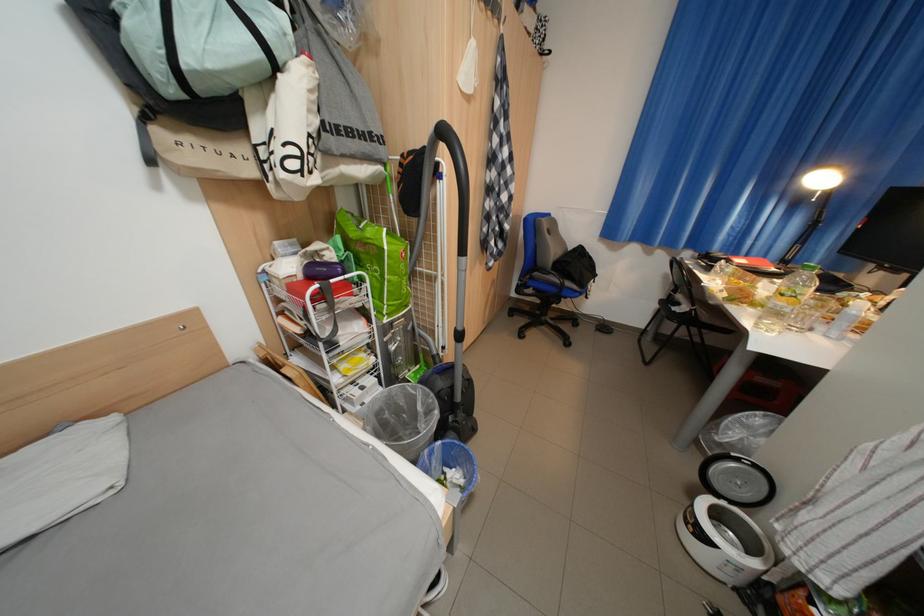
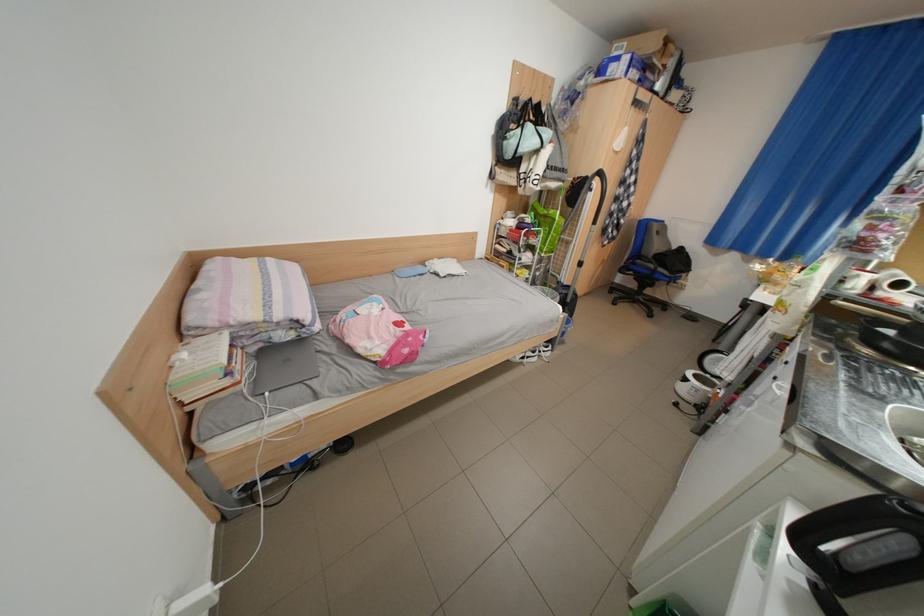
Locate, in the second image, the point that corresponds to point (543, 280) in the first image.

(646, 265)